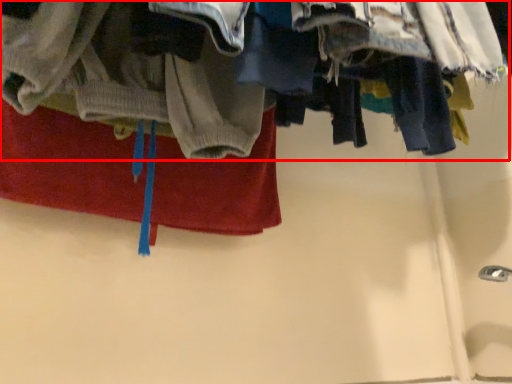
Question: From the image's perspective, what is the correct spatial positioning of closet (annotated by the red box) in reference to towel?

Choices:
 (A) below
 (B) above

Answer: (B)